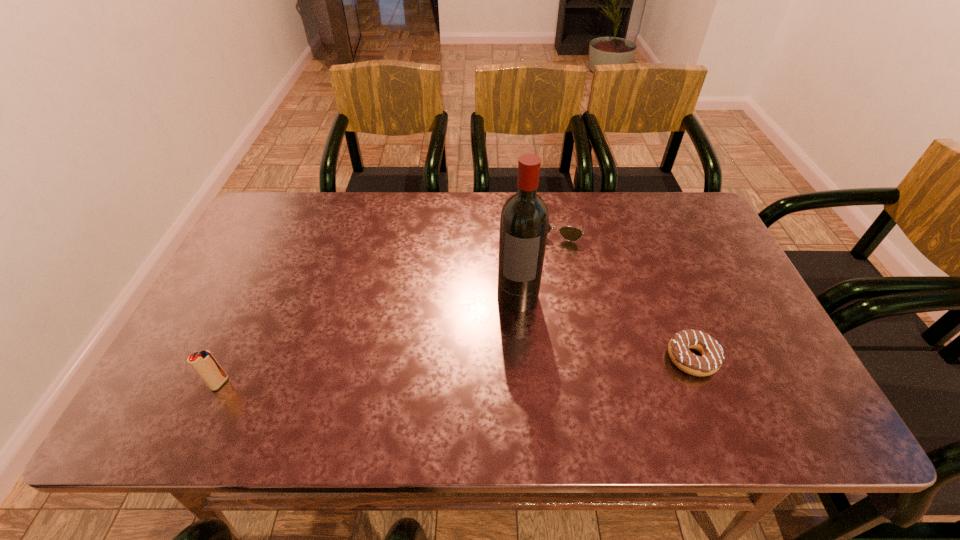
Find the location of a particular element. igniter is located at coordinates (205, 365).

Locate an element on the screen. the second tallest object is located at coordinates (205, 365).

Identify the location of doughnut. This screenshot has width=960, height=540. (712, 357).

You are a GUI agent. You are given a task and a screenshot of the screen. Output one action in this format:
    pyautogui.click(x=<x>, y=<y>)
    Task: Click on the rightmost object
    
    Given the screenshot: What is the action you would take?
    pyautogui.click(x=712, y=357)

Image resolution: width=960 pixels, height=540 pixels. Identify the location of the third nearest object. (524, 221).

Identify the location of wine bottle. Image resolution: width=960 pixels, height=540 pixels. (524, 221).

This screenshot has width=960, height=540. I want to click on the third tallest object, so click(x=569, y=233).

At what (x,y) coordinates should I click in order to perform the action: click on sunglasses. Please return your answer as a coordinate pair (x, y). This screenshot has width=960, height=540. Looking at the image, I should click on (569, 233).

What are the coordinates of `free region located 0.170m on the right of the igniter` in the screenshot? It's located at (302, 383).

The image size is (960, 540). In order to click on blank space located on the right of the doughnut in this screenshot , I will do `click(751, 358)`.